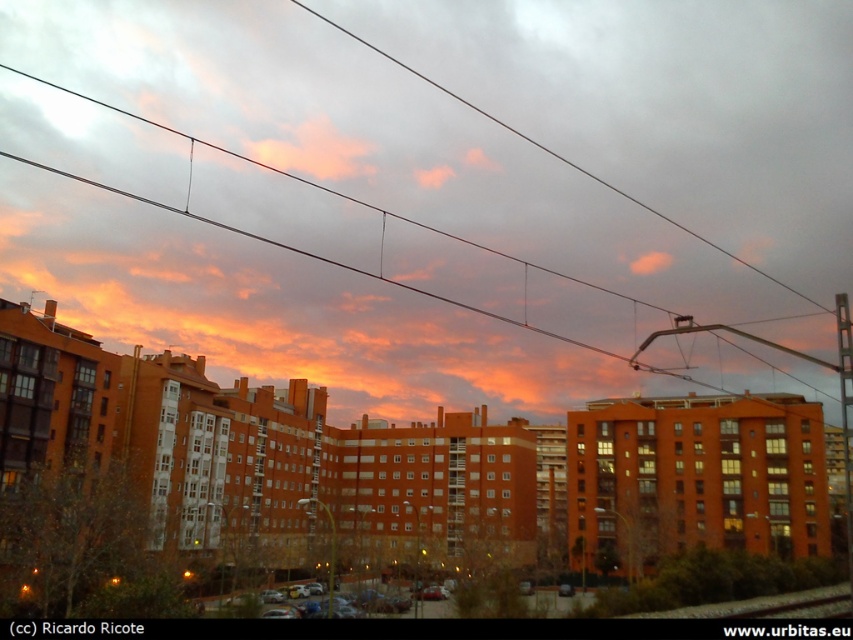
At what (x,y) coordinates should I click in order to perform the action: click on orange sky at center. Please return your answer as a coordinate pair (x, y). This screenshot has height=640, width=853. Looking at the image, I should click on (430, 184).

Which is above, orange sky at center or black metal train track at lower right?

Positioned higher is orange sky at center.

Find the location of a particular element. orange sky at center is located at coordinates (430, 184).

Identify the location of orange sky at center. (430, 184).